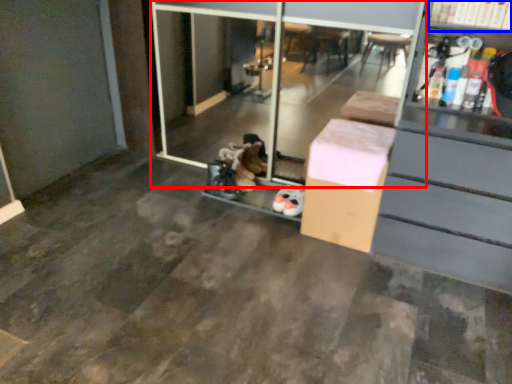
Question: Which object appears closest to the camera in this image, screen door (highlighted by a red box) or shelf (highlighted by a blue box)?

Choices:
 (A) screen door
 (B) shelf

Answer: (B)